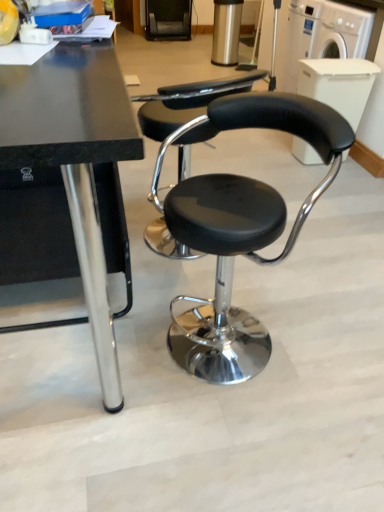
Identify the location of white plastic washing machine at upper right, which ranks as the first washing machine in bottom-to-top order. Image resolution: width=384 pixels, height=512 pixels. (343, 31).

This screenshot has width=384, height=512. Identify the location of black polished wood table at center. (75, 161).

From the image's perspective, is white plastic washing machine at upper right, which is the 2th washing machine from top to bottom, positioned above or below black leather stool at center?

Based on their image positions, white plastic washing machine at upper right, which is the 2th washing machine from top to bottom, is located above black leather stool at center.

Is white plastic washing machine at upper right, which is the 2th washing machine from top to bottom, inside or outside of black leather stool at center?

The correct answer is: outside.

Consider the image. Between white plastic washing machine at upper right, which is the 2th washing machine from top to bottom, and black leather stool at center, which one has less height?

With less height is white plastic washing machine at upper right, which is the 2th washing machine from top to bottom.

Which is in front, point (308, 50) or point (321, 30)?

Positioned in front is point (321, 30).

Looking at this image, from a real-world perspective, which object stands above the other?

white plastic washing machine at upper right, which is the 2th washing machine from top to bottom, from a real-world perspective.

In terms of height, does white plastic washing machine at upper right, the 1th washing machine when ordered from top to bottom, look taller or shorter compared to white plastic washing machine at upper right, which ranks as the first washing machine in bottom-to-top order?

white plastic washing machine at upper right, the 1th washing machine when ordered from top to bottom, is taller than white plastic washing machine at upper right, which ranks as the first washing machine in bottom-to-top order.

In terms of height, does white plastic washing machine at upper right, the 1th washing machine when ordered from top to bottom, look taller or shorter compared to black leather stool at center?

Clearly, white plastic washing machine at upper right, the 1th washing machine when ordered from top to bottom, is taller compared to black leather stool at center.

From the image's perspective, which washing machine is the 2nd one above the black leather stool at center? Please provide its 2D coordinates.

[(330, 55)]

From a real-world perspective, is white plastic washing machine at upper right, the 1th washing machine when ordered from top to bottom, on top of black leather stool at center?

Correct, in the physical world, white plastic washing machine at upper right, the 1th washing machine when ordered from top to bottom, is higher than black leather stool at center.

Which point is more distant from viewer, (360, 116) or (234, 206)?

The point (360, 116) is behind.

Is black polished wood table at center far from white plastic washing machine at upper right, which appears as the second washing machine when ordered from the bottom?

Absolutely, black polished wood table at center is distant from white plastic washing machine at upper right, which appears as the second washing machine when ordered from the bottom.

From the image's perspective, does black polished wood table at center appear lower than white plastic washing machine at upper right, the 1th washing machine when ordered from top to bottom?

Correct, black polished wood table at center appears lower than white plastic washing machine at upper right, the 1th washing machine when ordered from top to bottom, in the image.

Can you tell me how much black polished wood table at center and white plastic washing machine at upper right, the 1th washing machine when ordered from top to bottom, differ in facing direction?

The angle between the facing direction of black polished wood table at center and the facing direction of white plastic washing machine at upper right, the 1th washing machine when ordered from top to bottom, is 0.657 degrees.

In the scene shown: Is black polished wood table at center shorter than white plastic washing machine at upper right, which appears as the second washing machine when ordered from the bottom?

In fact, black polished wood table at center may be taller than white plastic washing machine at upper right, which appears as the second washing machine when ordered from the bottom.

Is white plastic washing machine at upper right, the 1th washing machine when ordered from top to bottom, at the right side of black polished wood table at center?

Yes, white plastic washing machine at upper right, the 1th washing machine when ordered from top to bottom, is to the right of black polished wood table at center.

You are a GUI agent. You are given a task and a screenshot of the screen. Output one action in this format:
    pyautogui.click(x=<x>, y=<y>)
    Task: Click on the washing machine below the black polished wood table at center (from a real-world perspective)
    This screenshot has height=512, width=384.
    Given the screenshot: What is the action you would take?
    pyautogui.click(x=330, y=55)

Is white plastic washing machine at upper right, which appears as the second washing machine when ordered from the bottom, directly adjacent to black polished wood table at center?

No, white plastic washing machine at upper right, which appears as the second washing machine when ordered from the bottom, is not next to black polished wood table at center.

From a real-world perspective, relative to black polished wood table at center, is white plastic washing machine at upper right, which appears as the second washing machine when ordered from the bottom, vertically above or below?

white plastic washing machine at upper right, which appears as the second washing machine when ordered from the bottom, is below black polished wood table at center.

Could you measure the distance between black leather stool at center and white plastic washing machine at upper right, the 1th washing machine when ordered from top to bottom?

black leather stool at center and white plastic washing machine at upper right, the 1th washing machine when ordered from top to bottom, are 6.18 feet apart.

Is the surface of black leather stool at center in direct contact with white plastic washing machine at upper right, the 1th washing machine when ordered from top to bottom?

No, black leather stool at center is not next to white plastic washing machine at upper right, the 1th washing machine when ordered from top to bottom.

Looking at this image, is black leather stool at center turned away from white plastic washing machine at upper right, the 1th washing machine when ordered from top to bottom?

Yes, white plastic washing machine at upper right, the 1th washing machine when ordered from top to bottom, is at the back of black leather stool at center.

Is white plastic washing machine at upper right, which is the 2th washing machine from top to bottom, directly adjacent to black polished wood table at center?

No, white plastic washing machine at upper right, which is the 2th washing machine from top to bottom, is not next to black polished wood table at center.

Is white plastic washing machine at upper right, which is the 2th washing machine from top to bottom, smaller than black polished wood table at center?

Yes, white plastic washing machine at upper right, which is the 2th washing machine from top to bottom, is smaller than black polished wood table at center.

Identify the location of washing machine that is above the black polished wood table at center (from a real-world perspective). (343, 31).

Could you measure the distance between white plastic washing machine at upper right, which is the 2th washing machine from top to bottom, and black polished wood table at center?

7.34 feet.

Where is `the 2nd washing machine behind the black leather stool at center, counting from the anchor's position`? The height and width of the screenshot is (512, 384). the 2nd washing machine behind the black leather stool at center, counting from the anchor's position is located at coordinates (343, 31).

Locate an element on the screen. The image size is (384, 512). washing machine that appears above the white plastic washing machine at upper right, which ranks as the first washing machine in bottom-to-top order (from the image's perspective) is located at coordinates (330, 55).

When comparing their distances from black leather stool at center, does white plastic washing machine at upper right, which ranks as the first washing machine in bottom-to-top order, or white plastic washing machine at upper right, which appears as the second washing machine when ordered from the bottom, seem further?

Based on the image, white plastic washing machine at upper right, which ranks as the first washing machine in bottom-to-top order, appears to be further to black leather stool at center.

In the scene shown: From the image, which object appears to be farther from black polished wood table at center, white plastic washing machine at upper right, which appears as the second washing machine when ordered from the bottom, or white plastic washing machine at upper right, which is the 2th washing machine from top to bottom?

white plastic washing machine at upper right, which is the 2th washing machine from top to bottom, lies further to black polished wood table at center than the other object.

Considering their positions, is white plastic washing machine at upper right, which ranks as the first washing machine in bottom-to-top order, positioned further to white plastic washing machine at upper right, which appears as the second washing machine when ordered from the bottom, than black leather stool at center?

black leather stool at center is further to white plastic washing machine at upper right, which appears as the second washing machine when ordered from the bottom.

Considering their positions, is black polished wood table at center positioned closer to white plastic washing machine at upper right, the 1th washing machine when ordered from top to bottom, than white plastic washing machine at upper right, which ranks as the first washing machine in bottom-to-top order?

white plastic washing machine at upper right, which ranks as the first washing machine in bottom-to-top order, is positioned closer to the anchor white plastic washing machine at upper right, the 1th washing machine when ordered from top to bottom.

Looking at the image, which one is located closer to white plastic washing machine at upper right, which appears as the second washing machine when ordered from the bottom, black polished wood table at center or black leather stool at center?

black leather stool at center is closer to white plastic washing machine at upper right, which appears as the second washing machine when ordered from the bottom.

Which object lies further to the anchor point white plastic washing machine at upper right, which ranks as the first washing machine in bottom-to-top order, black polished wood table at center or black leather stool at center?

Among the two, black polished wood table at center is located further to white plastic washing machine at upper right, which ranks as the first washing machine in bottom-to-top order.

Estimate the real-world distances between objects in this image. Which object is closer to black polished wood table at center, white plastic washing machine at upper right, which appears as the second washing machine when ordered from the bottom, or black leather stool at center?

Based on the image, black leather stool at center appears to be nearer to black polished wood table at center.

Considering their positions, is black leather stool at center positioned further to black polished wood table at center than white plastic washing machine at upper right, which appears as the second washing machine when ordered from the bottom?

Among the two, white plastic washing machine at upper right, which appears as the second washing machine when ordered from the bottom, is located further to black polished wood table at center.

This screenshot has height=512, width=384. I want to click on chair between black polished wood table at center and white plastic washing machine at upper right, which appears as the second washing machine when ordered from the bottom, from front to back, so click(x=239, y=229).

Where is `chair between black polished wood table at center and white plastic washing machine at upper right, which is the 2th washing machine from top to bottom, along the z-axis`? The width and height of the screenshot is (384, 512). chair between black polished wood table at center and white plastic washing machine at upper right, which is the 2th washing machine from top to bottom, along the z-axis is located at coordinates (239, 229).

Find the location of a particular element. washing machine located between black leather stool at center and white plastic washing machine at upper right, which ranks as the first washing machine in bottom-to-top order, in the depth direction is located at coordinates (330, 55).

Where is `washing machine between black polished wood table at center and white plastic washing machine at upper right, which ranks as the first washing machine in bottom-to-top order, along the z-axis`? washing machine between black polished wood table at center and white plastic washing machine at upper right, which ranks as the first washing machine in bottom-to-top order, along the z-axis is located at coordinates (330, 55).